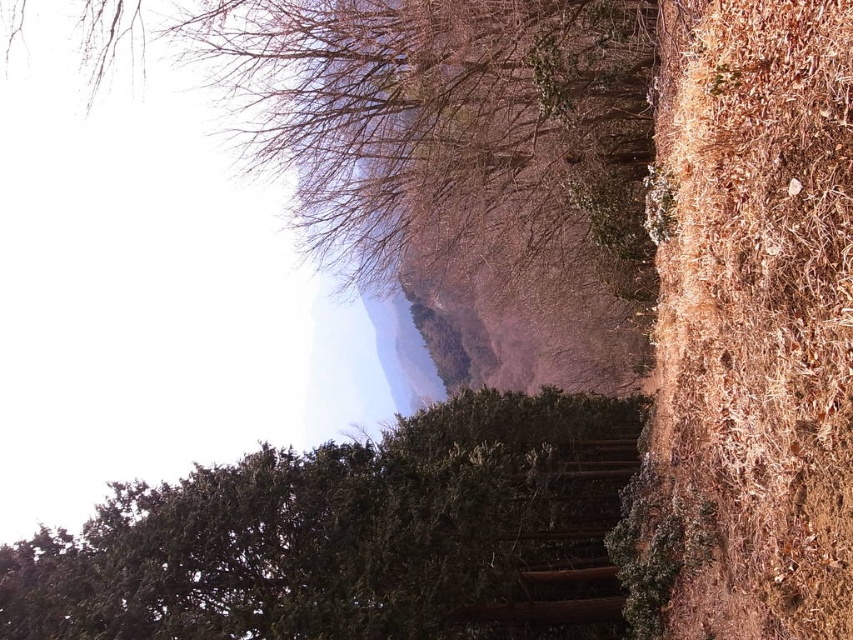
You are standing at the bottom of the brown wooden stairs at center and want to reach the brown textured tree at upper center. Which direction should you move in to get closer to the tree?

The brown textured tree at upper center is located above the brown wooden stairs at center, so you should move upward or climb the stairs to get closer to the tree.

Looking at this image, you are standing at the bottom of the brown wooden stairs at center, looking towards the brown textured tree at upper center. Which object is taller?

The brown textured tree at upper center is taller than the brown wooden stairs at center.

You are an environmental scientist studying tree distribution in this landscape. You observe the green textured tree at center and the brown textured tree at upper center. Which tree is positioned to the right of the other?

The green textured tree at center is positioned to the right of the brown textured tree at upper center.